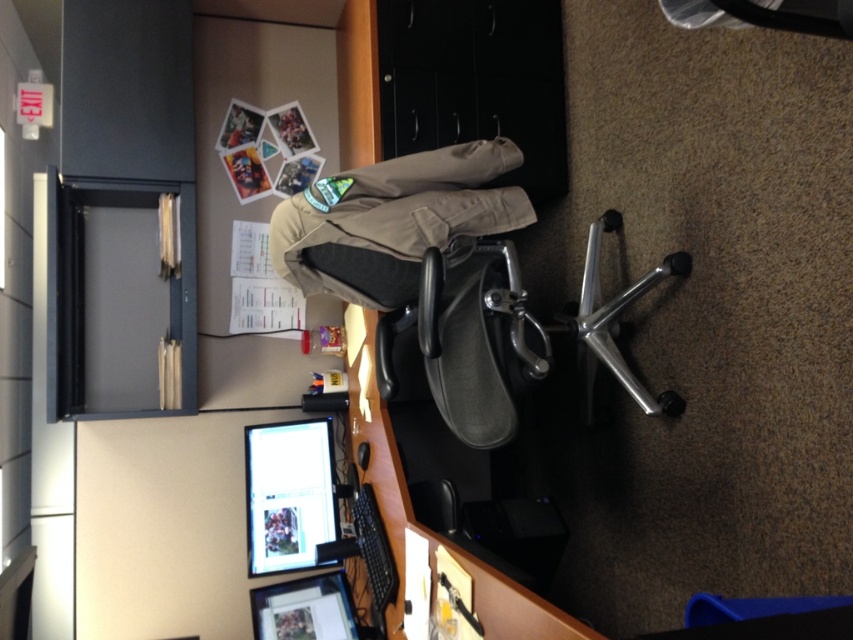
Question: Can you confirm if khaki cotton pants at center is positioned above matte black monitor at lower left?

Choices:
 (A) yes
 (B) no

Answer: (A)

Question: Is khaki cotton pants at center wider than matte black monitor at lower left?

Choices:
 (A) yes
 (B) no

Answer: (A)

Question: Which of the following is the farthest from the observer?

Choices:
 (A) [300, 477]
 (B) [448, 173]

Answer: (A)

Question: In this image, where is khaki cotton pants at center located relative to matte black monitor at lower left?

Choices:
 (A) above
 (B) below

Answer: (A)

Question: Which point is farther to the camera?

Choices:
 (A) (297, 502)
 (B) (386, 264)

Answer: (A)

Question: Which point is farther to the camera?

Choices:
 (A) (485, 218)
 (B) (331, 465)

Answer: (B)